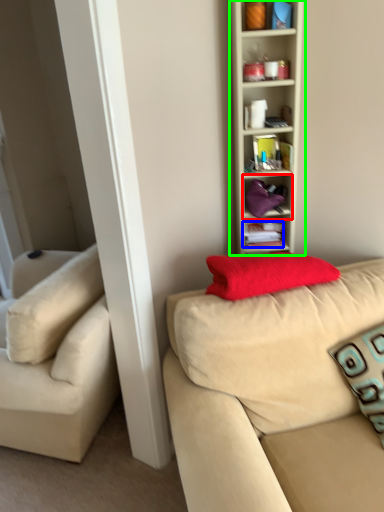
Question: Estimate the real-world distances between objects in this image. Which object is farther from cabinet (highlighted by a red box), book (highlighted by a blue box) or shelf (highlighted by a green box)?

Choices:
 (A) book
 (B) shelf

Answer: (B)